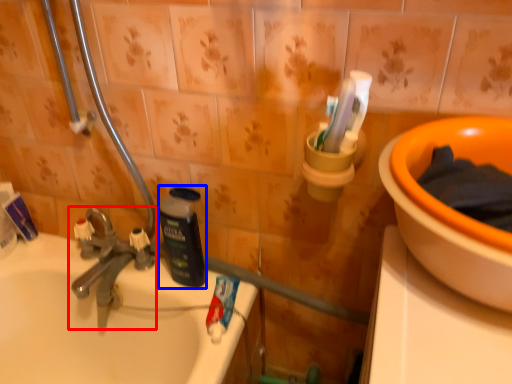
Question: Which point is closer to the camera, tap (highlighted by a red box) or bottle (highlighted by a blue box)?

Choices:
 (A) tap
 (B) bottle

Answer: (B)